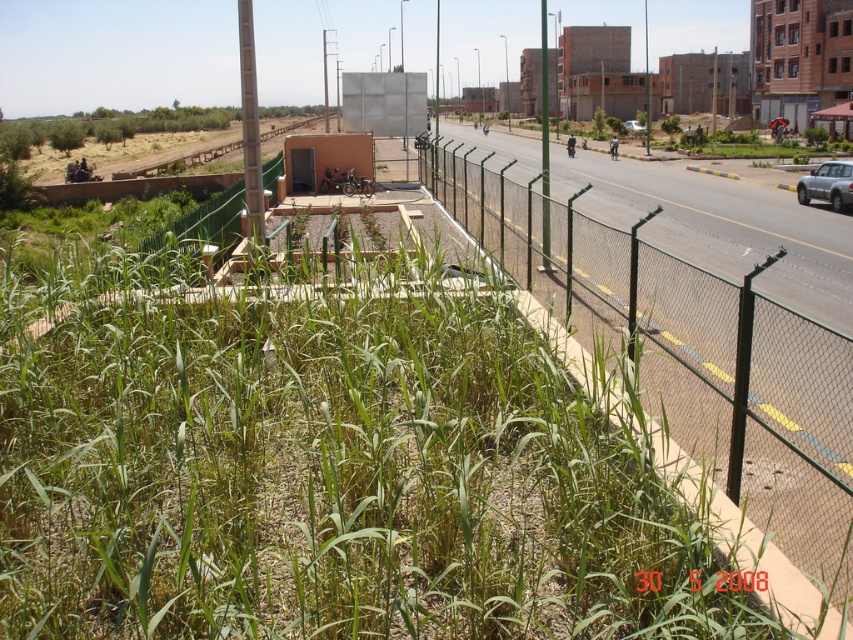
In the scene shown: You are a gardener who needs to place a 3m wide decorative stone path between the green grass at lower left and the green wire mesh fence at right. Is there enough space between them to fit the path?

The green grass at lower left is narrower than the green wire mesh fence at right. Since the path requires 3m width, but the space between them is not specified, the answer cannot be determined with the given information.

You are standing in the urban landscape scene and want to walk from the green grass at lower left to the green wire mesh fence at right. Which direction should you move to get closer to the fence?

To move closer to the green wire mesh fence at right, you should walk away from the green grass at lower left since it is closer to the viewer than the fence.

You are a delivery driver who needs to park your satin silver car at right in a spot that is exactly as wide as the green wire mesh fence at right. According to the scene, is this parking spot wide enough for your car?

The green wire mesh fence at right is wider than the satin silver car at right, so the parking spot is wide enough for the satin silver car at right.